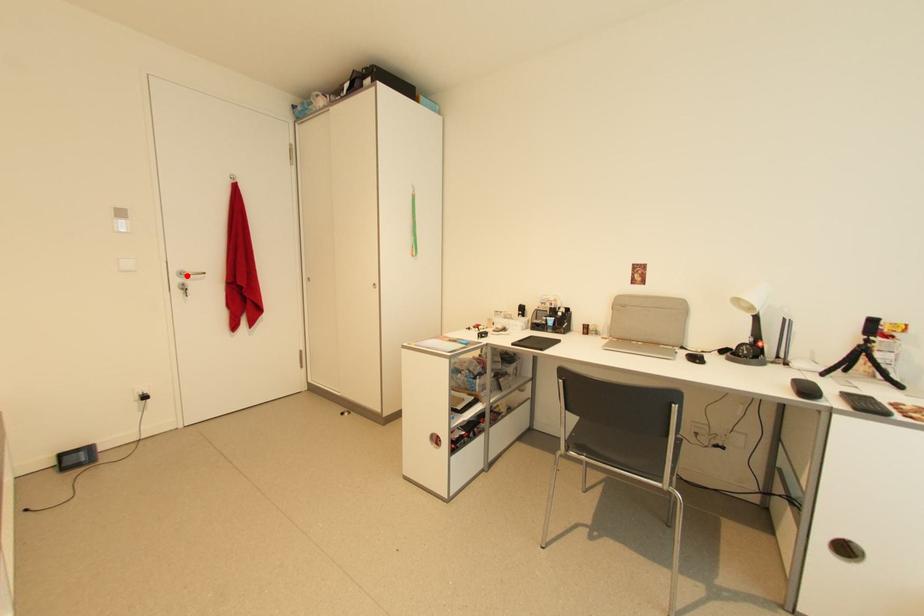
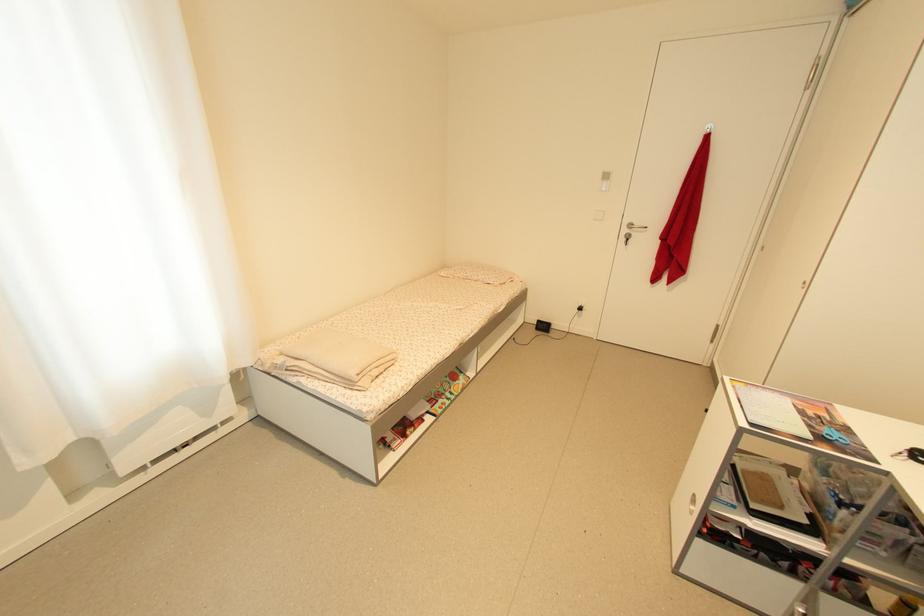
Question: A red point is marked in image1. In image2, is the corresponding 3D point closer to the camera or farther? Reply with the corresponding letter.

Choices:
 (A) The corresponding 3D point is closer.
 (B) The corresponding 3D point is farther.

Answer: (A)